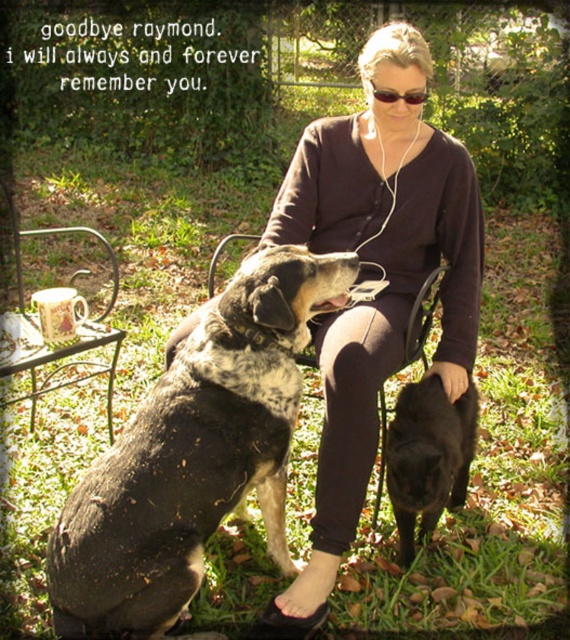
Question: Can you confirm if black matte dog at lower right is positioned to the right of sunglasses at center?

Choices:
 (A) no
 (B) yes

Answer: (B)

Question: Which of these objects is positioned closest to the sunglasses at center?

Choices:
 (A) matte brown shirt at center
 (B) black matte dog at lower right

Answer: (A)

Question: Is matte brown shirt at center closer to camera compared to speckled fur dog at center?

Choices:
 (A) yes
 (B) no

Answer: (B)

Question: Which object appears closest to the camera in this image?

Choices:
 (A) sunglasses at center
 (B) matte brown shirt at center
 (C) speckled fur dog at center

Answer: (C)

Question: Is speckled fur dog at center closer to camera compared to sunglasses at center?

Choices:
 (A) yes
 (B) no

Answer: (A)

Question: Estimate the real-world distances between objects in this image. Which object is closer to the black matte dog at lower right?

Choices:
 (A) speckled fur dog at center
 (B) matte brown shirt at center
 (C) sunglasses at center

Answer: (B)